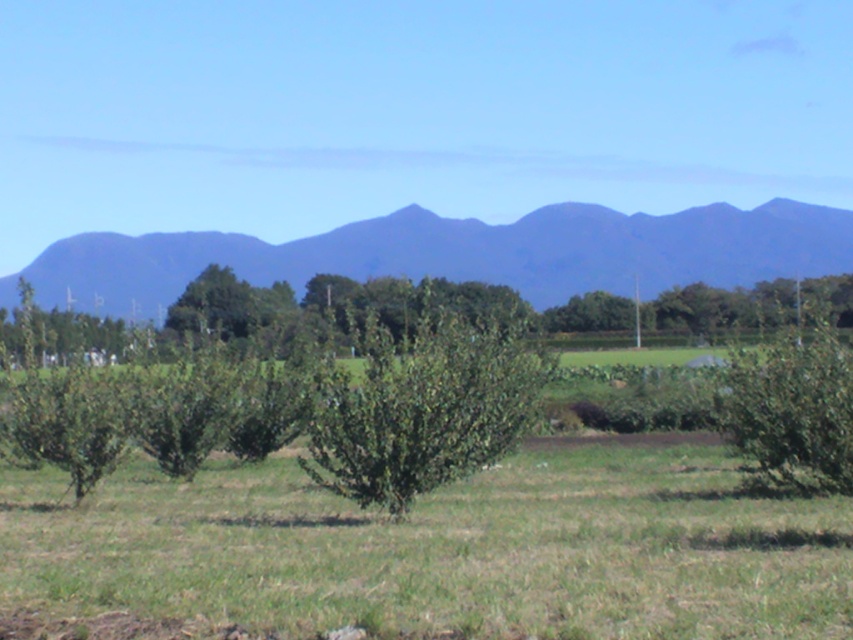
Who is more distant from viewer, (306, 257) or (756, 468)?

Positioned behind is point (306, 257).

Describe the element at coordinates (466, 253) in the screenshot. I see `blue matte mountain at upper center` at that location.

Is point (357, 234) positioned after point (781, 465)?

Yes, point (357, 234) is farther from viewer.

Locate an element on the screen. blue matte mountain at upper center is located at coordinates (466, 253).